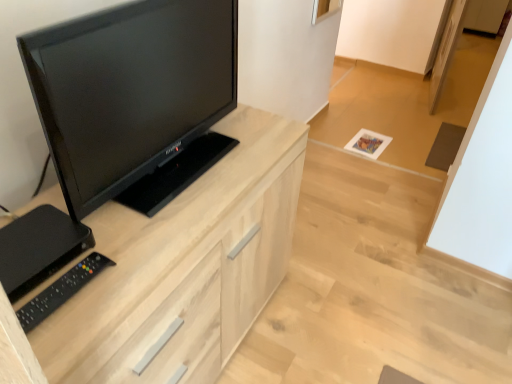
What are the coordinates of `vacant space situated above light wood cabinet at center (from a real-world perspective)` in the screenshot? It's located at (167, 191).